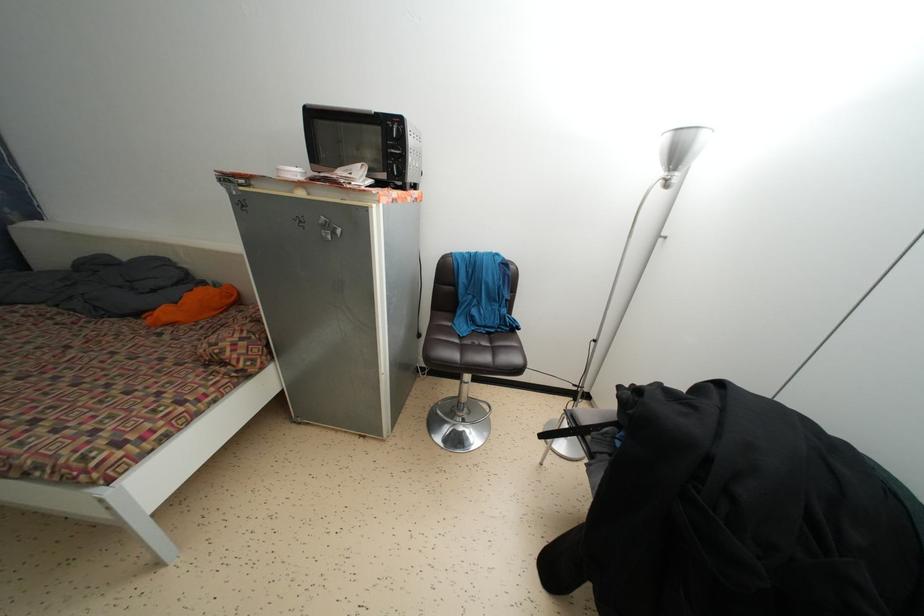
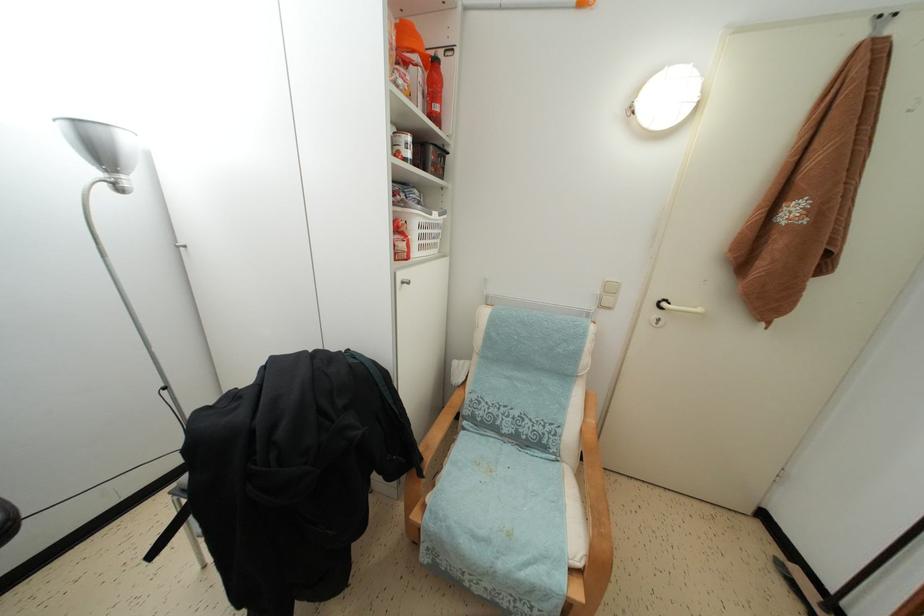
The images are taken continuously from a first-person perspective. In which direction is your viewpoint rotating?

The rotation direction of the camera is right-down.